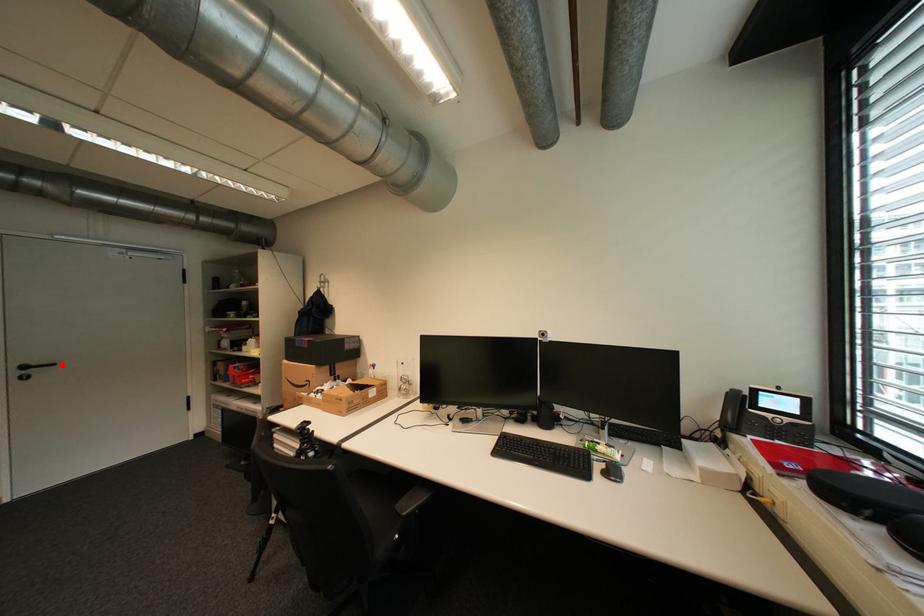
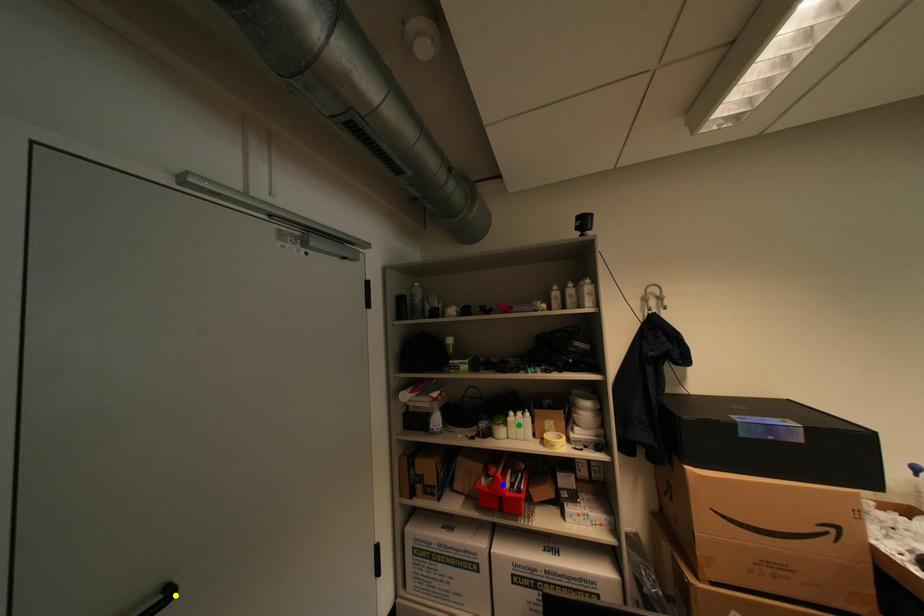
Question: I am providing you with two images of the same scene from different viewpoints. A red point is marked on the first image. You are given multiple points on the second image. In image 2, which mark is for the same physical point as the one in image 1?

Choices:
 (A) green point
 (B) yellow point
 (C) blue point

Answer: (B)